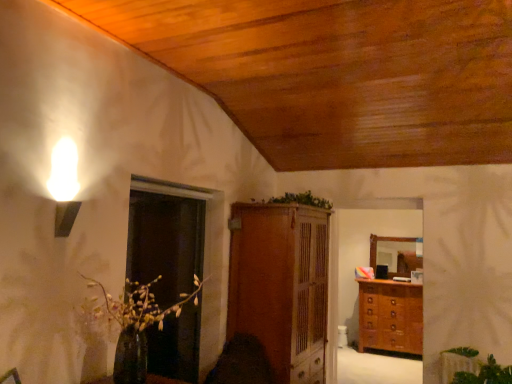
Question: Considering the positions of wooden chest of drawers at right and transparent glass door at center in the image, is wooden chest of drawers at right taller or shorter than transparent glass door at center?

Choices:
 (A) tall
 (B) short

Answer: (B)

Question: Considering the positions of wooden chest of drawers at right and transparent glass door at center in the image, is wooden chest of drawers at right wider or thinner than transparent glass door at center?

Choices:
 (A) thin
 (B) wide

Answer: (B)

Question: Based on their relative distances, which object is nearer to the wooden cabinet at center?

Choices:
 (A) green leafy plant at center, which appears as the second plant when ordered from the bottom
 (B) transparent glass door at center
 (C) green leafy plant at lower right, the 1th plant when ordered from right to left
 (D) wooden chest of drawers at right

Answer: (A)

Question: Estimate the real-world distances between objects in this image. Which object is closer to the green leafy plant at center, the first plant when ordered from left to right?

Choices:
 (A) transparent glass door at center
 (B) wooden chest of drawers at right
 (C) green leafy plant at lower right, the first plant when ordered from bottom to top
 (D) wooden cabinet at center

Answer: (D)